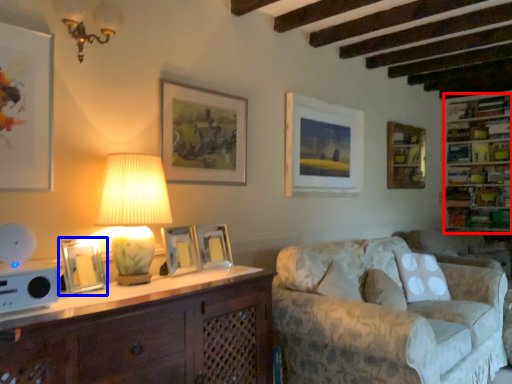
Question: Among these objects, which one is farthest to the camera, shelf (highlighted by a red box) or picture frame (highlighted by a blue box)?

Choices:
 (A) shelf
 (B) picture frame

Answer: (A)